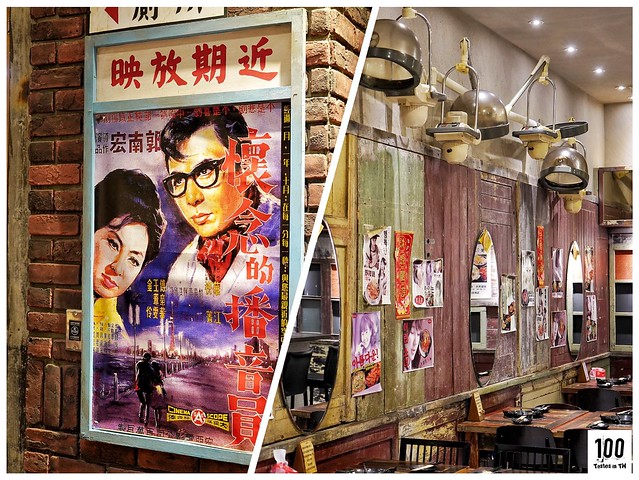
Identify the location of 2nd oval mirror. (491, 330).